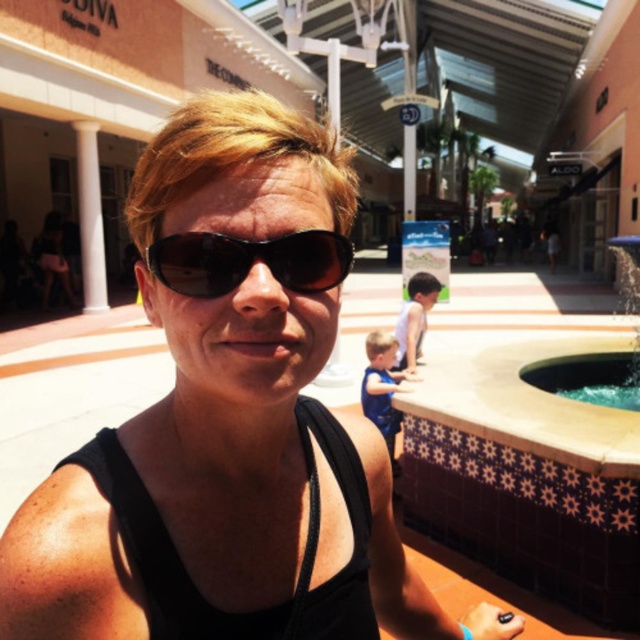
You are standing in the shopping mall plaza and want to place a new bench exactly at the coordinates where the sunglasses at center are located. Is this possible? Please explain using the scene description.

The sunglasses at center are located at coordinates point (248, 260). Since the scene description does not mention any obstacles or structures at that specific point, it is possible to place the bench there.

You are a visitor at the mall and want to take a photo of the clear glass pool at lower right without the white marble pillar at left blocking the view. Is there enough space between them to do so?

The clear glass pool at lower right occupies less space than the white marble pillar at left, so there might not be enough space between them to take a photo without the pillar blocking the view.

You are standing at the fountain in the shopping mall and want to take a photo of both the person in the foreground and the ALDO store sign in the background. Which point, point (348, 266) or point (630, 408), is closer to the camera?

Point (348, 266) is closer to the camera than point (630, 408).